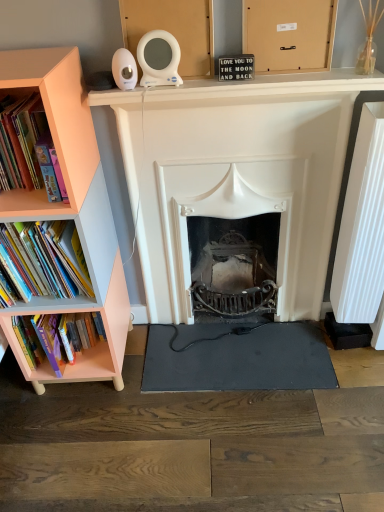
I want to click on vacant area that is in front of matte cardboard box at upper center, so click(282, 77).